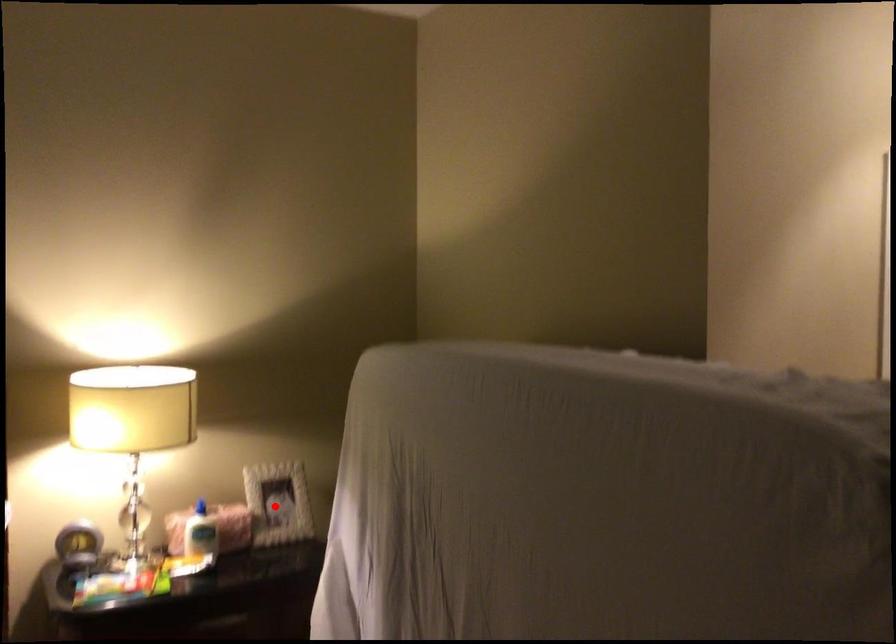
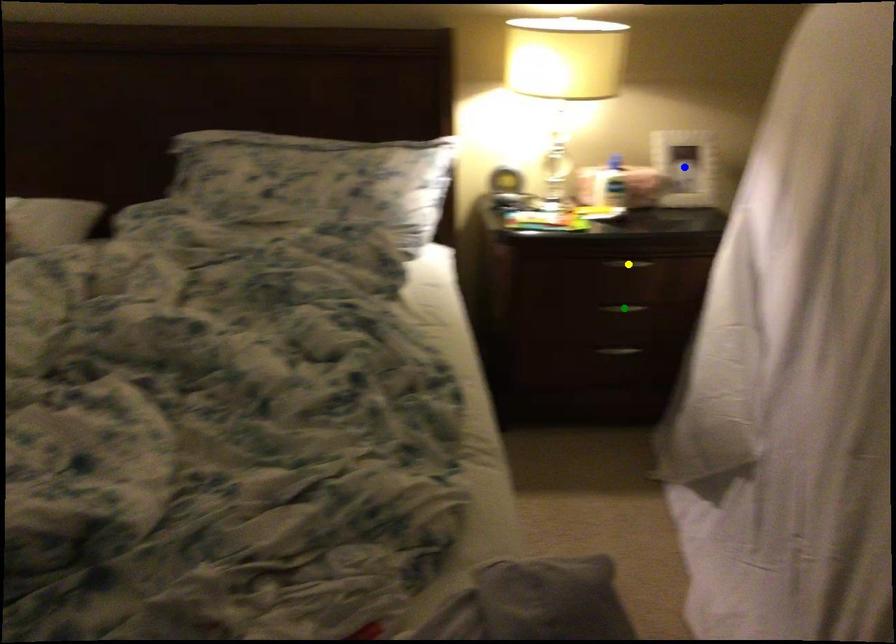
Question: I am providing you with two images of the same scene from different viewpoints. A red point is marked on the first image. You are given multiple points on the second image. Which mark in image 2 goes with the point in image 1?

Choices:
 (A) blue point
 (B) yellow point
 (C) green point

Answer: (A)